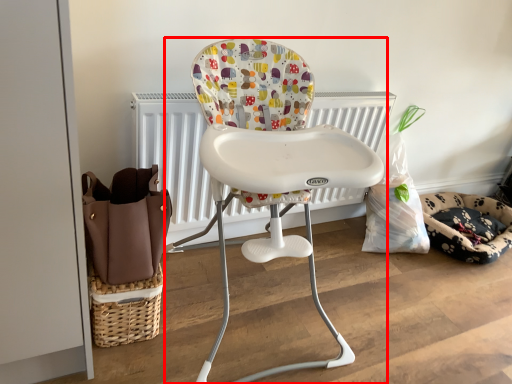
Question: From the image's perspective, considering the relative positions of chair (annotated by the red box) and dog bed in the image provided, where is chair (annotated by the red box) located with respect to the staircase?

Choices:
 (A) below
 (B) above

Answer: (B)